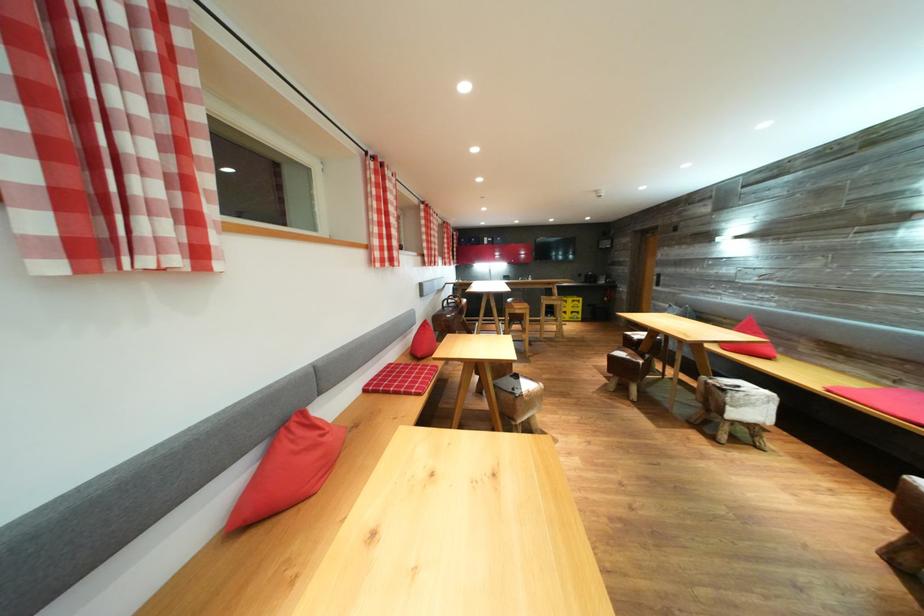
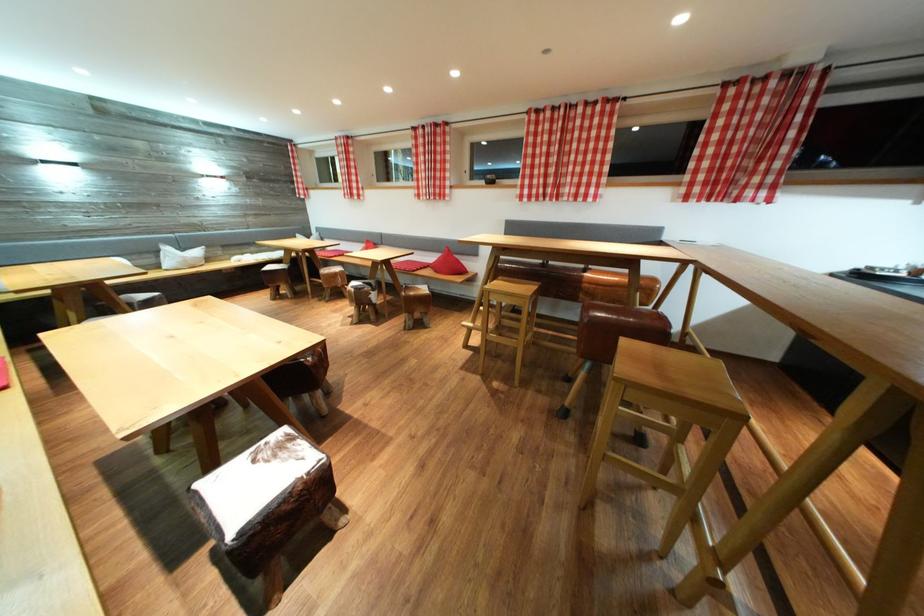
Question: I am providing you with two images of the same scene from different viewpoints. Please identify which objects are invisible in image2.

Choices:
 (A) bench sitting surface
 (B) light wood stool
 (C) white pillow bag
 (D) briefcase handle

Answer: (A)